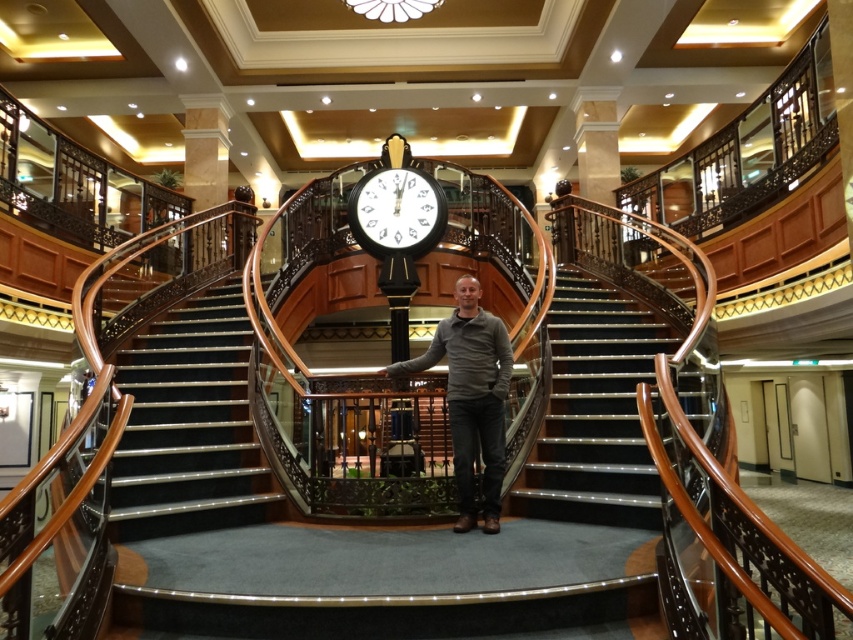
Consider the image. You are standing at point (189, 424) in the grand staircase area. Which object is directly beneath you?

The polished wood stairs at center are directly beneath you at point (189, 424).

You are a hotel guest carrying a dark gray sweater at center and need to pass through a narrow corridor. The corridor has a white marble pillar at upper center in the way. Can the sweater fit through the space between the pillar and the wall?

The dark gray sweater at center is wider than the white marble pillar at upper center, so it may not fit through the space between the pillar and the wall. Check the available width before attempting to pass.